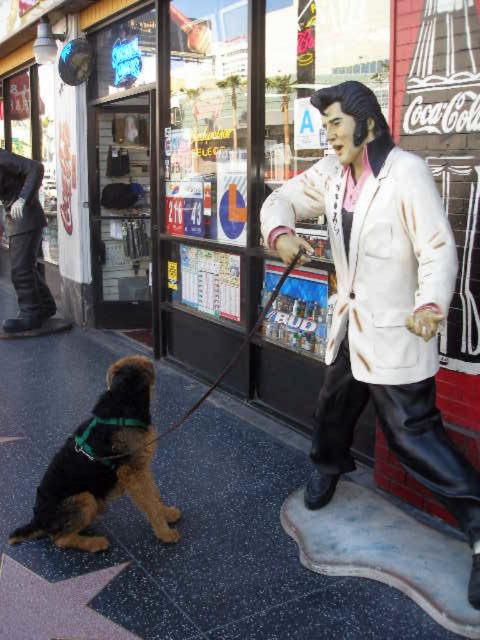
Question: Which of the following is the closest to the observer?

Choices:
 (A) tap(204, 394)
 (B) tap(14, 326)

Answer: (A)

Question: Is white matte statue at right positioned before white matte lab coat at center?

Choices:
 (A) yes
 (B) no

Answer: (A)

Question: Is white matte statue at right to the right of white matte lab coat at center from the viewer's perspective?

Choices:
 (A) no
 (B) yes

Answer: (B)

Question: Which of the following is the closest to the observer?

Choices:
 (A) white matte lab coat at center
 (B) metallic star at lower left
 (C) brown fuzzy dog at lower left
 (D) black leather leash at lower left

Answer: (A)

Question: Is black asphalt at lower left above black leather leash at lower left?

Choices:
 (A) no
 (B) yes

Answer: (A)

Question: Estimate the real-world distances between objects in this image. Which object is farther from the white matte statue at right?

Choices:
 (A) brown fuzzy dog at lower left
 (B) black asphalt at lower left

Answer: (A)